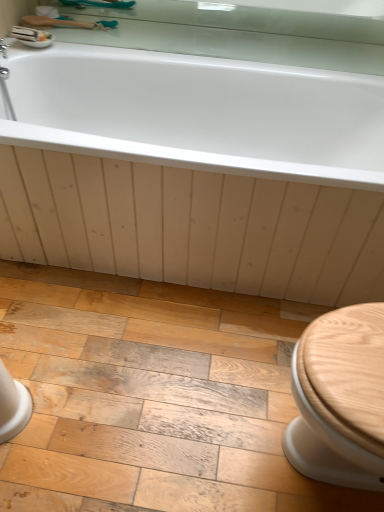
Question: Should I look upward or downward to see white glossy bathtub at upper center?

Choices:
 (A) up
 (B) down

Answer: (A)

Question: Is clear glass mirror at upper center wider than wooden brush at upper left?

Choices:
 (A) no
 (B) yes

Answer: (A)

Question: Does clear glass mirror at upper center come behind wooden brush at upper left?

Choices:
 (A) no
 (B) yes

Answer: (A)

Question: From a real-world perspective, does clear glass mirror at upper center sit lower than wooden brush at upper left?

Choices:
 (A) no
 (B) yes

Answer: (A)

Question: Is clear glass mirror at upper center closer to camera compared to wooden brush at upper left?

Choices:
 (A) no
 (B) yes

Answer: (B)

Question: Would you say wooden brush at upper left is part of clear glass mirror at upper center's contents?

Choices:
 (A) no
 (B) yes

Answer: (A)

Question: Can you confirm if clear glass mirror at upper center is thinner than wooden brush at upper left?

Choices:
 (A) yes
 (B) no

Answer: (A)

Question: From a real-world perspective, is white glossy bathtub at upper center on top of white glossy sink at upper left?

Choices:
 (A) yes
 (B) no

Answer: (B)

Question: Does white glossy bathtub at upper center turn towards white glossy sink at upper left?

Choices:
 (A) yes
 (B) no

Answer: (B)

Question: Is white glossy bathtub at upper center far from white glossy sink at upper left?

Choices:
 (A) yes
 (B) no

Answer: (B)

Question: Does white glossy bathtub at upper center have a greater width compared to white glossy sink at upper left?

Choices:
 (A) no
 (B) yes

Answer: (B)

Question: Is white glossy bathtub at upper center shorter than white glossy sink at upper left?

Choices:
 (A) no
 (B) yes

Answer: (A)

Question: Can you confirm if white glossy bathtub at upper center is positioned to the right of white glossy sink at upper left?

Choices:
 (A) yes
 (B) no

Answer: (A)

Question: Considering the relative sizes of wooden floor at lower center and white glossy sink at upper left in the image provided, is wooden floor at lower center bigger than white glossy sink at upper left?

Choices:
 (A) yes
 (B) no

Answer: (A)